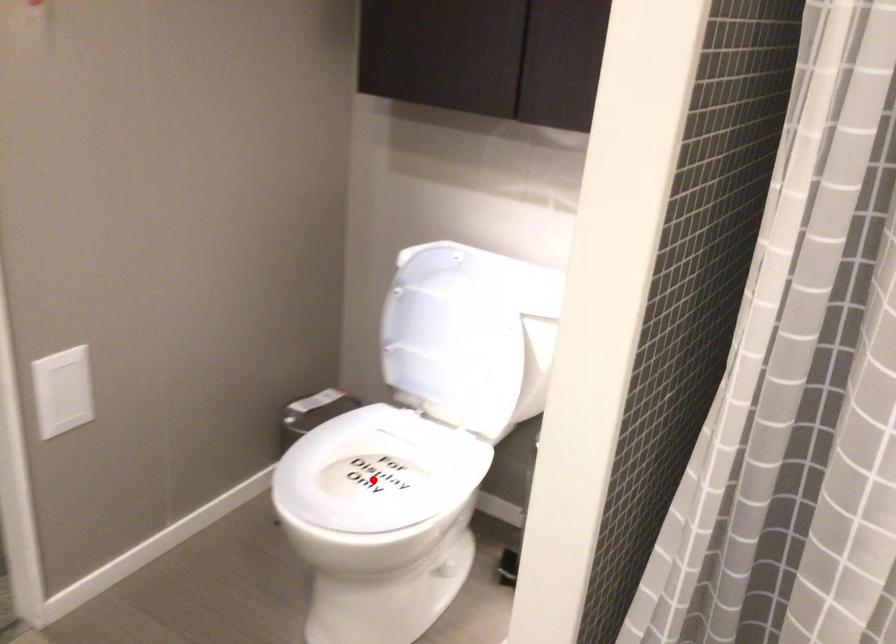
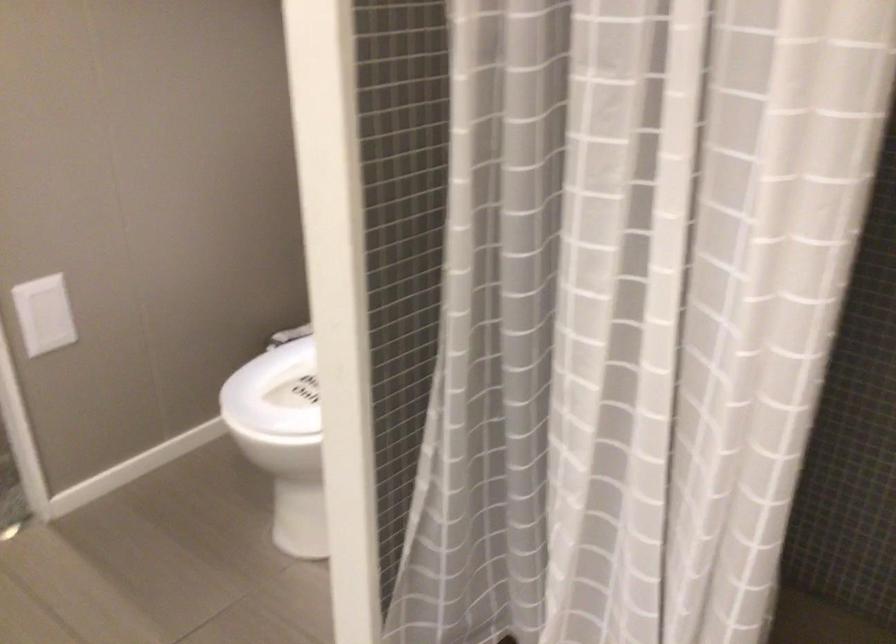
Question: I am providing you with two images of the same scene from different viewpoints. A red point is marked on the first image. At the location where the point appears in image 1, is it still visible in image 2?

Choices:
 (A) Yes
 (B) No

Answer: (B)